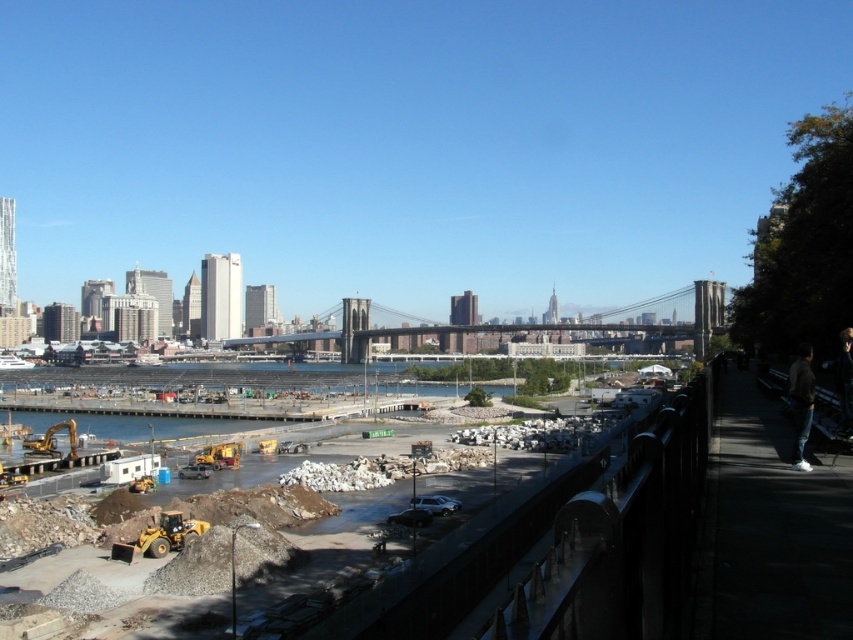
Question: Which point is closer to the camera?

Choices:
 (A) gravelly dirt at center
 (B) dark gray hoodie at right
 (C) metallic gray bridge at center

Answer: (A)

Question: Is gravelly dirt at center bigger than metallic gray bridge at center?

Choices:
 (A) yes
 (B) no

Answer: (B)

Question: Estimate the real-world distances between objects in this image. Which object is closer to the gravelly dirt at center?

Choices:
 (A) dark gray hoodie at right
 (B) metallic gray bridge at center

Answer: (A)

Question: Which is nearer to the metallic gray bridge at center?

Choices:
 (A) gravelly dirt at center
 (B) dark gray hoodie at right

Answer: (A)

Question: Observing the image, what is the correct spatial positioning of gravelly dirt at center in reference to dark gray hoodie at right?

Choices:
 (A) left
 (B) right

Answer: (A)

Question: Does gravelly dirt at center have a larger size compared to dark gray hoodie at right?

Choices:
 (A) yes
 (B) no

Answer: (A)